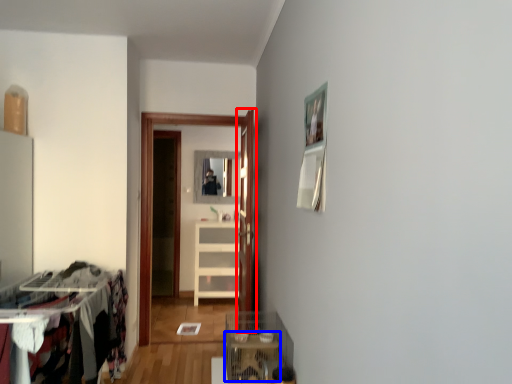
Question: Among these objects, which one is farthest to the camera, door (highlighted by a red box) or table (highlighted by a blue box)?

Choices:
 (A) door
 (B) table

Answer: (A)